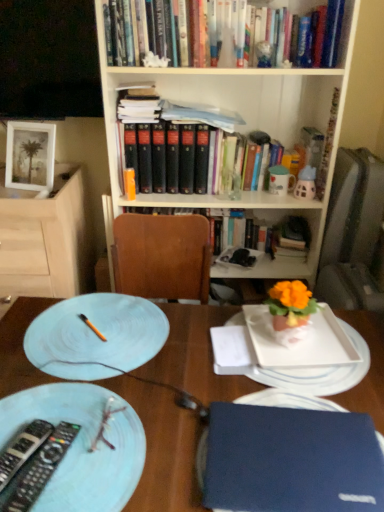
Question: Are matte white plate at left and blue matte laptop at lower right located far from each other?

Choices:
 (A) yes
 (B) no

Answer: (B)

Question: Does matte white plate at left lie in front of blue matte laptop at lower right?

Choices:
 (A) yes
 (B) no

Answer: (B)

Question: From the image's perspective, would you say matte white plate at left is shown under blue matte laptop at lower right?

Choices:
 (A) no
 (B) yes

Answer: (A)

Question: Considering the relative sizes of matte white plate at left and blue matte laptop at lower right in the image provided, is matte white plate at left smaller than blue matte laptop at lower right?

Choices:
 (A) yes
 (B) no

Answer: (A)

Question: Can you confirm if matte white plate at left is wider than blue matte laptop at lower right?

Choices:
 (A) yes
 (B) no

Answer: (B)

Question: Based on their sizes in the image, would you say wooden bookcase at upper center is bigger or smaller than blue hardcover book at lower right?

Choices:
 (A) small
 (B) big

Answer: (B)

Question: From the image's perspective, is wooden bookcase at upper center positioned above or below blue hardcover book at lower right?

Choices:
 (A) below
 (B) above

Answer: (B)

Question: Looking at their shapes, would you say wooden bookcase at upper center is wider or thinner than blue hardcover book at lower right?

Choices:
 (A) wide
 (B) thin

Answer: (A)

Question: Is wooden bookcase at upper center taller or shorter than blue hardcover book at lower right?

Choices:
 (A) short
 (B) tall

Answer: (B)

Question: Considering the positions of blue hardcover book at lower right and blue matte laptop at lower right in the image, is blue hardcover book at lower right taller or shorter than blue matte laptop at lower right?

Choices:
 (A) short
 (B) tall

Answer: (A)

Question: Is blue hardcover book at lower right inside or outside of blue matte laptop at lower right?

Choices:
 (A) outside
 (B) inside

Answer: (B)

Question: In terms of width, does blue hardcover book at lower right look wider or thinner when compared to blue matte laptop at lower right?

Choices:
 (A) thin
 (B) wide

Answer: (A)

Question: From the image's perspective, is blue hardcover book at lower right positioned above or below blue matte laptop at lower right?

Choices:
 (A) above
 (B) below

Answer: (A)

Question: Considering their positions, is black plastic remote control at lower left located in front of or behind matte ceramic mug at upper right?

Choices:
 (A) behind
 (B) front

Answer: (B)

Question: Does point (26, 467) appear closer or farther from the camera than point (276, 183)?

Choices:
 (A) closer
 (B) farther

Answer: (A)